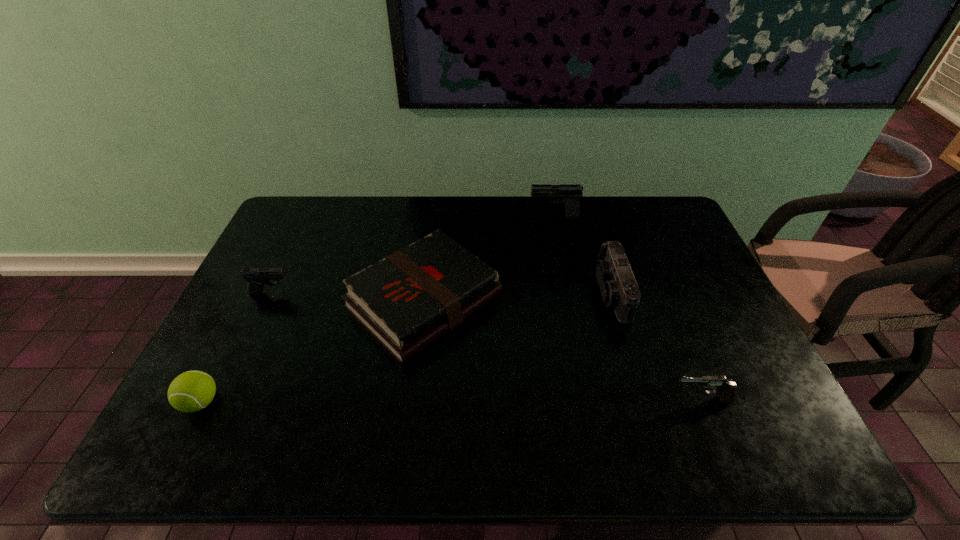
Locate an element on the screen. This screenshot has width=960, height=540. vacant space that's between the rightmost object and the tennis ball is located at coordinates (451, 401).

The image size is (960, 540). I want to click on empty space between the farthest object and the camcorder, so click(583, 255).

Find the location of `free spot between the tennis ball and the hardback book`. free spot between the tennis ball and the hardback book is located at coordinates (313, 352).

Identify the location of blank region between the nearest pistol and the tennis ball. This screenshot has height=540, width=960. [x=451, y=401].

Identify the location of vacant area that lies between the camcorder and the farthest pistol. (583, 255).

Identify the location of free space between the third object from left to right and the tallest pistol. (490, 259).

Image resolution: width=960 pixels, height=540 pixels. I want to click on empty space between the hardback book and the camcorder, so click(518, 297).

This screenshot has width=960, height=540. What are the coordinates of `the fifth closest object relative to the tennis ball` in the screenshot? It's located at (726, 389).

At what (x,y) coordinates should I click in order to perform the action: click on the third closest object to the rightmost object. Please return your answer as a coordinate pair (x, y). The width and height of the screenshot is (960, 540). Looking at the image, I should click on (571, 192).

Select which pistol appears as the closest to the camcorder. Please provide its 2D coordinates. Your answer should be formatted as a tuple, i.e. [(x, y)], where the tuple contains the x and y coordinates of a point satisfying the conditions above.

[(726, 389)]